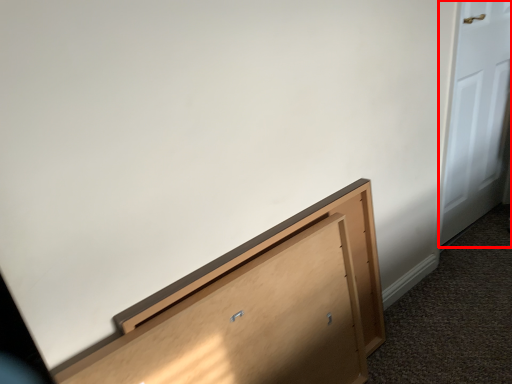
Question: Observing the image, what is the correct spatial positioning of door (annotated by the red box) in reference to furniture?

Choices:
 (A) right
 (B) left

Answer: (A)